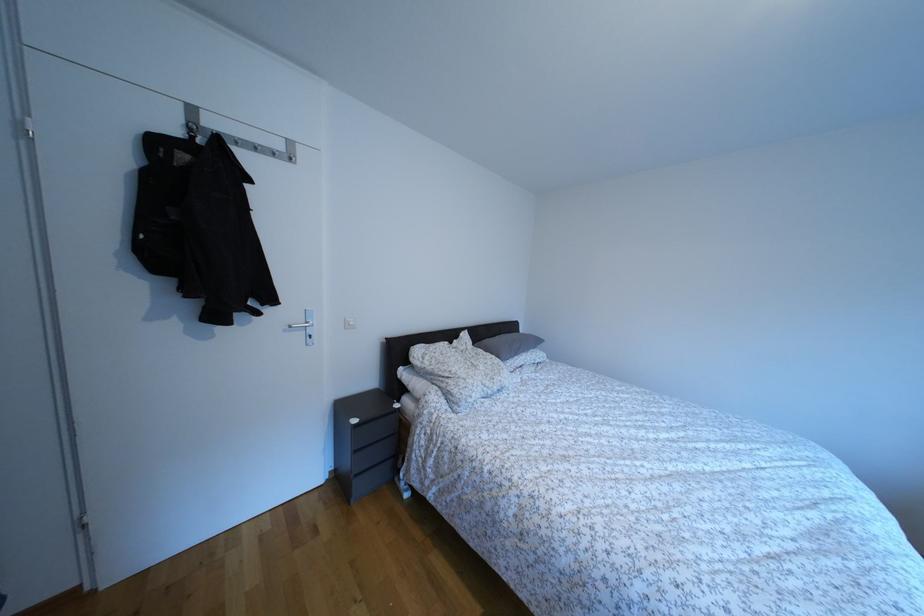
This screenshot has height=616, width=924. What do you see at coordinates (292, 159) in the screenshot? I see `the coat rack hook` at bounding box center [292, 159].